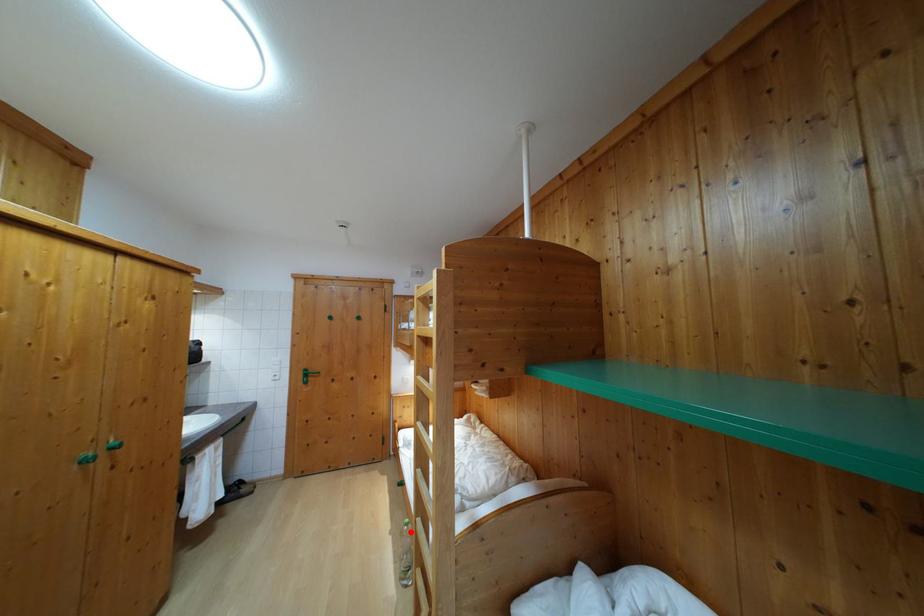
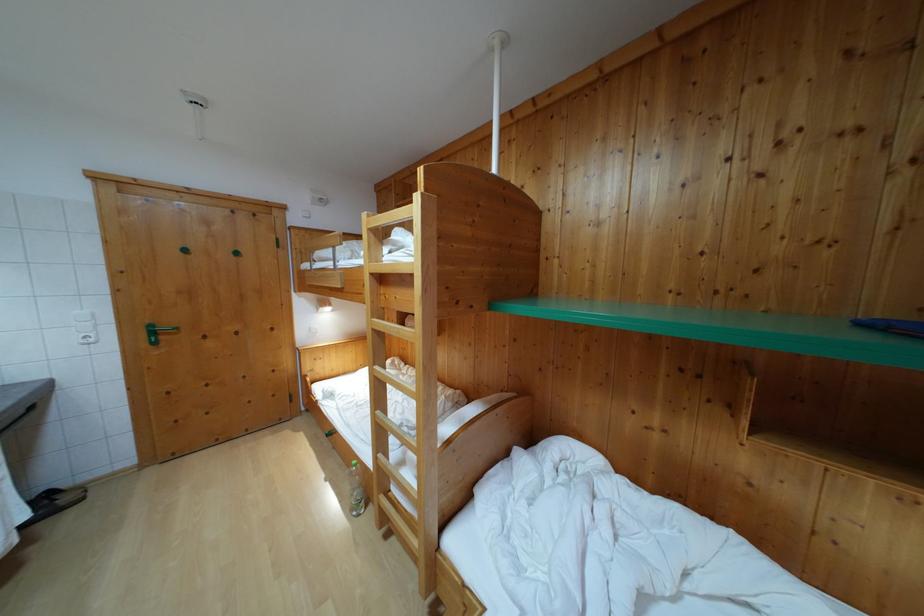
Find the pixel in the second image that matches the highlighted location in the first image.

(359, 472)